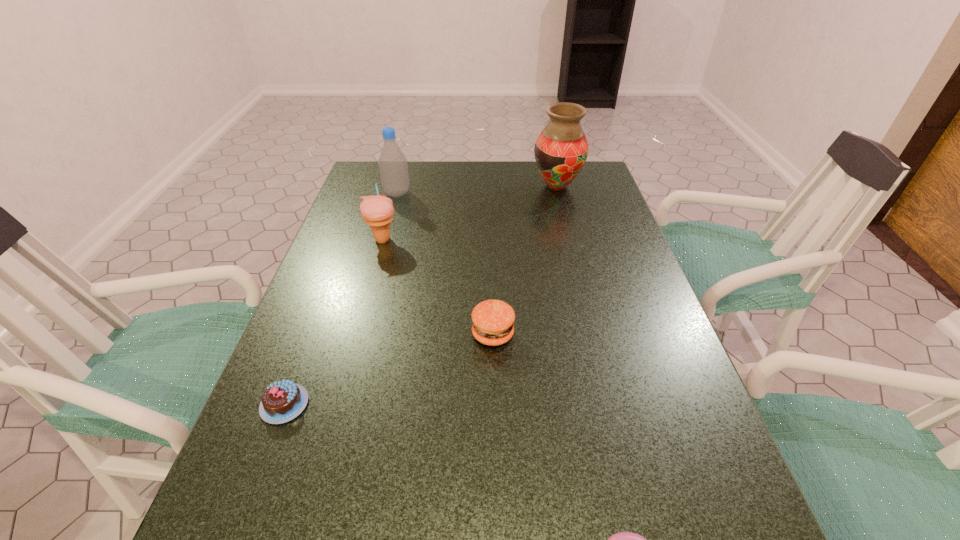
Find the location of a particular element. object that is at the far right corner is located at coordinates point(561,150).

The image size is (960, 540). In the image, there is a desktop. Identify the location of vacant area at the far edge. (489, 182).

At what (x,y) coordinates should I click in order to perform the action: click on vacant space at the left edge. Please return your answer as a coordinate pair (x, y). The height and width of the screenshot is (540, 960). Looking at the image, I should click on (303, 507).

At what (x,y) coordinates should I click in order to perform the action: click on vacant point at the right edge. Please return your answer as a coordinate pair (x, y). This screenshot has height=540, width=960. Looking at the image, I should click on (725, 461).

Locate an element on the screen. The height and width of the screenshot is (540, 960). vacant space at the far right corner is located at coordinates (559, 192).

At what (x,y) coordinates should I click in order to perform the action: click on empty space that is in between the leftmost object and the icecream. Please return your answer as a coordinate pair (x, y). The height and width of the screenshot is (540, 960). Looking at the image, I should click on (333, 322).

Locate an element on the screen. This screenshot has width=960, height=540. vacant area that lies between the patty and the second shortest object is located at coordinates (389, 369).

Locate an element on the screen. blank region between the vase and the bottle is located at coordinates (477, 190).

This screenshot has width=960, height=540. What are the coordinates of `vacant point located between the fifth tallest object and the icecream` in the screenshot? It's located at (333, 322).

At what (x,y) coordinates should I click in order to perform the action: click on free space between the fifth tallest object and the vase. Please return your answer as a coordinate pair (x, y). Looking at the image, I should click on (420, 295).